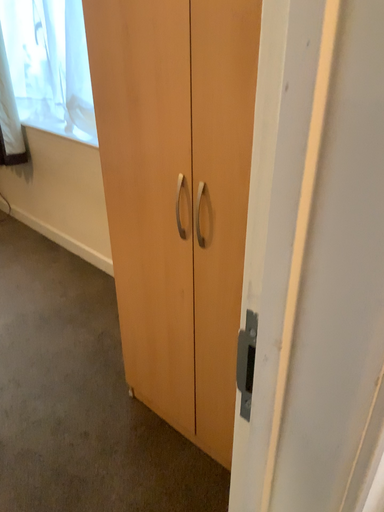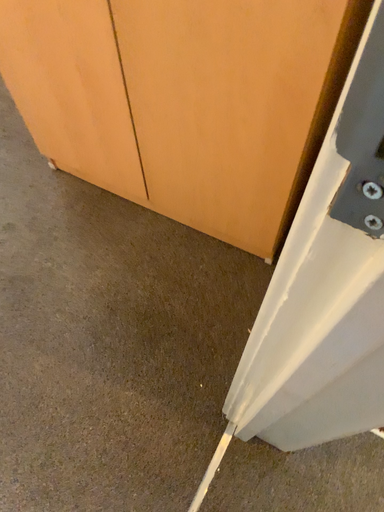
Question: How did the camera likely rotate when shooting the video?

Choices:
 (A) rotated upward
 (B) rotated downward

Answer: (B)